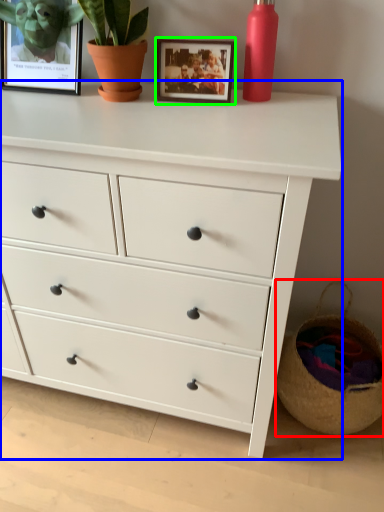
Question: Considering the real-world distances, which object is closest to basket (highlighted by a red box)? chest of drawers (highlighted by a blue box) or picture frame (highlighted by a green box).

Choices:
 (A) chest of drawers
 (B) picture frame

Answer: (A)